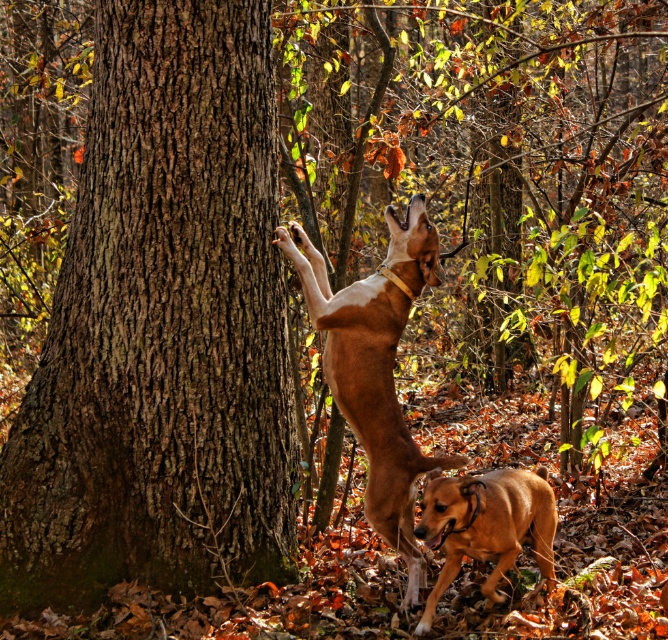
Question: Among these objects, which one is farthest from the camera?

Choices:
 (A) brown rough bark at center
 (B) brown glossy dog at center

Answer: (A)

Question: Is brown rough bark at center smaller than brown glossy dog at center?

Choices:
 (A) no
 (B) yes

Answer: (A)

Question: Which point is farther to the camera?

Choices:
 (A) brown leather dog at lower right
 (B) brown glossy dog at center

Answer: (B)

Question: Does brown glossy dog at center appear on the right side of brown leather dog at lower right?

Choices:
 (A) yes
 (B) no

Answer: (B)

Question: Estimate the real-world distances between objects in this image. Which object is farther from the brown rough bark at center?

Choices:
 (A) brown leather dog at lower right
 (B) brown glossy dog at center

Answer: (A)

Question: Is brown rough bark at center wider than brown glossy dog at center?

Choices:
 (A) yes
 (B) no

Answer: (A)